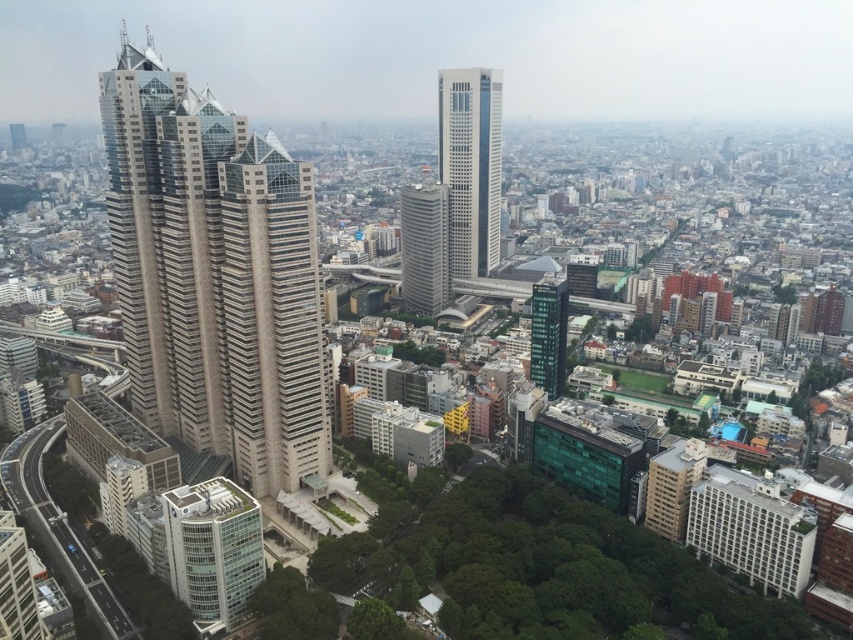
You are a drone operator flying a drone over the urban landscape. Your drone is currently above the white glass skyscraper at center and the green glass building at center. Which building should you descend towards first if you want to land closer to the ground level? Explain your reasoning based on their positions.

You should descend towards the white glass skyscraper at center first because it is closer to the viewer than the green glass building at center, meaning it is physically nearer in the actual space. Since the drone is above both, landing on the closer building would require less altitude adjustment compared to the farther one.